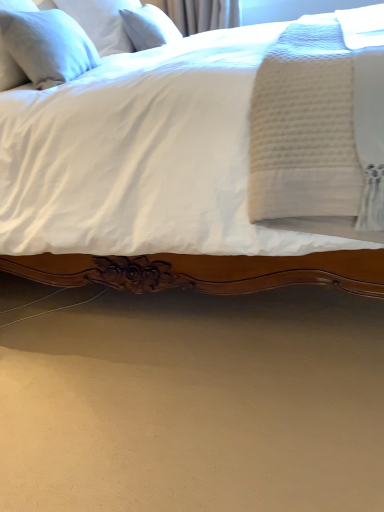
Question: Is white soft pillow at upper left, which is counted as the third pillow, starting from the front, positioned behind white linen pillow at upper left, placed as the first pillow when sorted from front to back?

Choices:
 (A) no
 (B) yes

Answer: (B)

Question: Is white soft pillow at upper left, the 1th pillow when ordered from back to front, shorter than white linen pillow at upper left, placed as the first pillow when sorted from front to back?

Choices:
 (A) no
 (B) yes

Answer: (B)

Question: Is white soft pillow at upper left, the 1th pillow when ordered from back to front, to the right of white linen pillow at upper left, placed as the first pillow when sorted from front to back, from the viewer's perspective?

Choices:
 (A) yes
 (B) no

Answer: (A)

Question: Can you confirm if white soft pillow at upper left, the 1th pillow when ordered from back to front, is smaller than white linen pillow at upper left, placed as the first pillow when sorted from front to back?

Choices:
 (A) no
 (B) yes

Answer: (B)

Question: Is white soft pillow at upper left, which is counted as the third pillow, starting from the front, not inside white linen pillow at upper left, the third pillow viewed from the back?

Choices:
 (A) no
 (B) yes

Answer: (B)

Question: Considering the relative positions of white soft pillow at upper left, which is the 2th pillow from back to front, and white linen pillow at upper left, placed as the first pillow when sorted from front to back, in the image provided, is white soft pillow at upper left, which is the 2th pillow from back to front, to the left or to the right of white linen pillow at upper left, placed as the first pillow when sorted from front to back,?

Choices:
 (A) left
 (B) right

Answer: (B)

Question: Does point (89, 29) appear closer or farther from the camera than point (29, 48)?

Choices:
 (A) closer
 (B) farther

Answer: (B)

Question: Considering the positions of white soft pillow at upper left, which is the 2th pillow from back to front, and white linen pillow at upper left, placed as the first pillow when sorted from front to back, in the image, is white soft pillow at upper left, which is the 2th pillow from back to front, bigger or smaller than white linen pillow at upper left, placed as the first pillow when sorted from front to back,?

Choices:
 (A) small
 (B) big

Answer: (B)

Question: From the image's perspective, is white soft pillow at upper left, marked as the second pillow in a front-to-back arrangement, located above or below white linen pillow at upper left, placed as the first pillow when sorted from front to back?

Choices:
 (A) below
 (B) above

Answer: (B)

Question: Considering the relative positions of white linen pillow at upper left, the third pillow viewed from the back, and white soft pillow at upper left, which is the 2th pillow from back to front, in the image provided, is white linen pillow at upper left, the third pillow viewed from the back, to the left or to the right of white soft pillow at upper left, which is the 2th pillow from back to front,?

Choices:
 (A) left
 (B) right

Answer: (A)

Question: In terms of size, does white linen pillow at upper left, the third pillow viewed from the back, appear bigger or smaller than white soft pillow at upper left, which is the 2th pillow from back to front?

Choices:
 (A) small
 (B) big

Answer: (A)

Question: Does point (57, 40) appear closer or farther from the camera than point (89, 36)?

Choices:
 (A) farther
 (B) closer

Answer: (B)

Question: From a real-world perspective, is white linen pillow at upper left, the third pillow viewed from the back, positioned above or below white soft pillow at upper left, marked as the second pillow in a front-to-back arrangement?

Choices:
 (A) below
 (B) above

Answer: (A)

Question: In terms of size, does white soft pillow at upper left, the 1th pillow when ordered from back to front, appear bigger or smaller than white linen pillow at upper left, placed as the first pillow when sorted from front to back?

Choices:
 (A) small
 (B) big

Answer: (A)

Question: Looking at their shapes, would you say white soft pillow at upper left, the 1th pillow when ordered from back to front, is wider or thinner than white linen pillow at upper left, placed as the first pillow when sorted from front to back?

Choices:
 (A) thin
 (B) wide

Answer: (B)